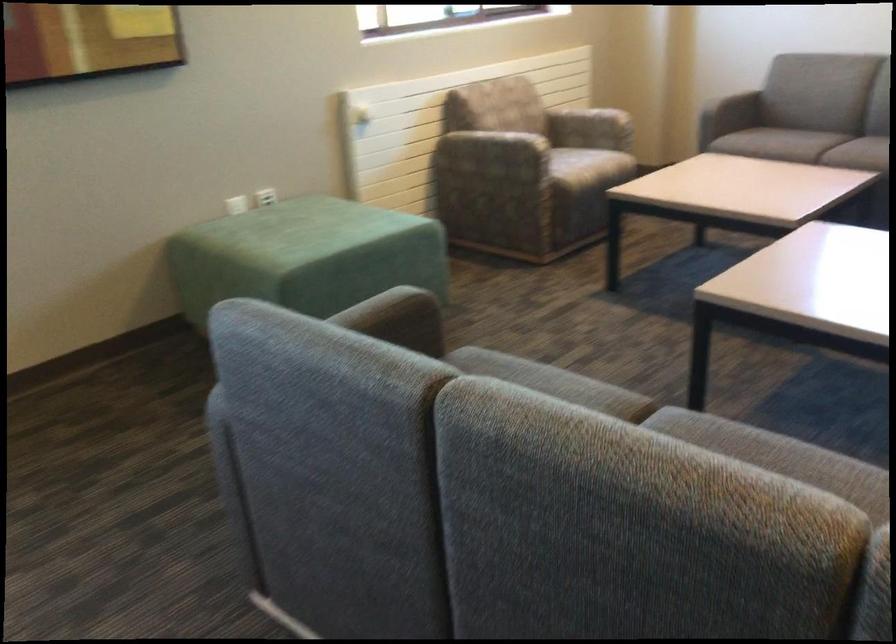
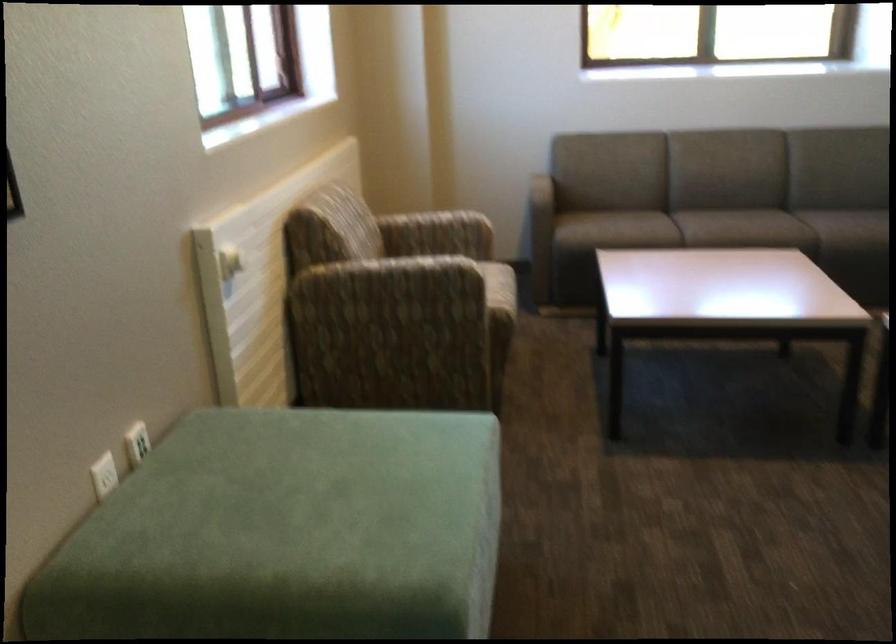
Find the pixel in the second image that matches [477,167] in the first image.

(386, 312)